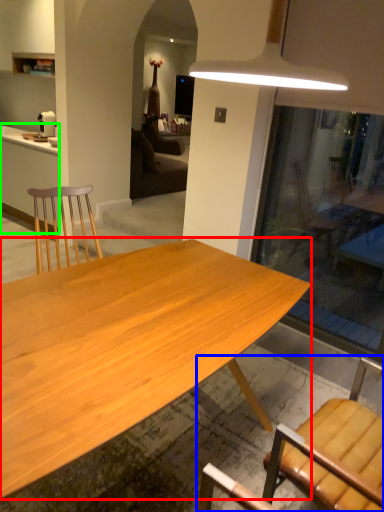
Question: Which object is the farthest from desk (highlighted by a red box)? Choose among these: chair (highlighted by a blue box) or cabinetry (highlighted by a green box).

Choices:
 (A) chair
 (B) cabinetry

Answer: (B)